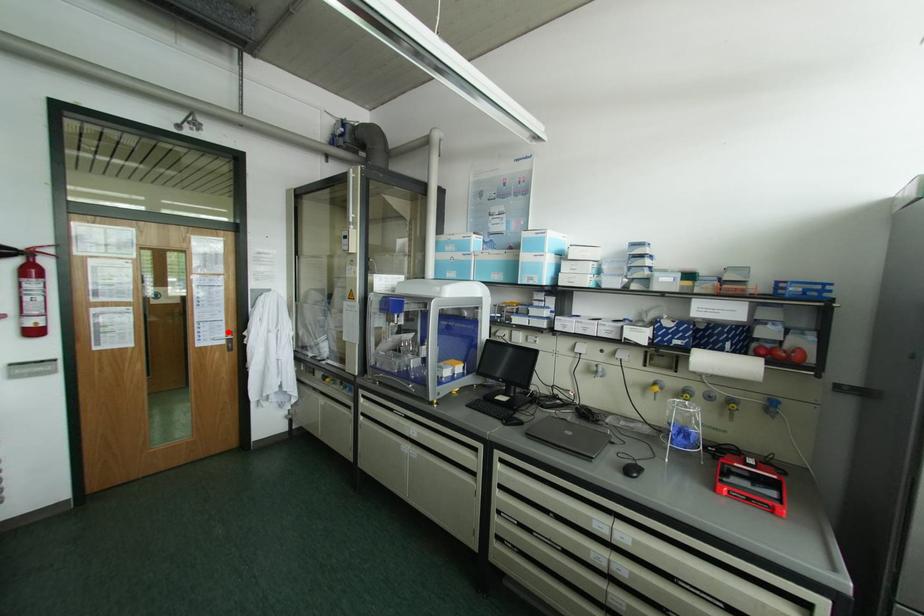
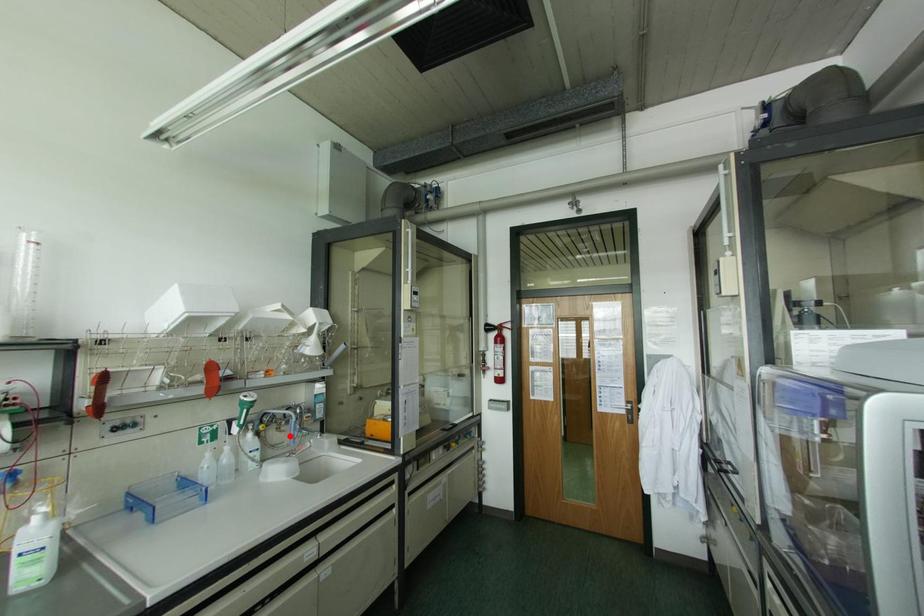
I am providing you with two images of the same scene from different viewpoints. A red point is marked on the first image and another point is marked on the second image. Is the red point in image1 aligned with the point shown in image2?

No